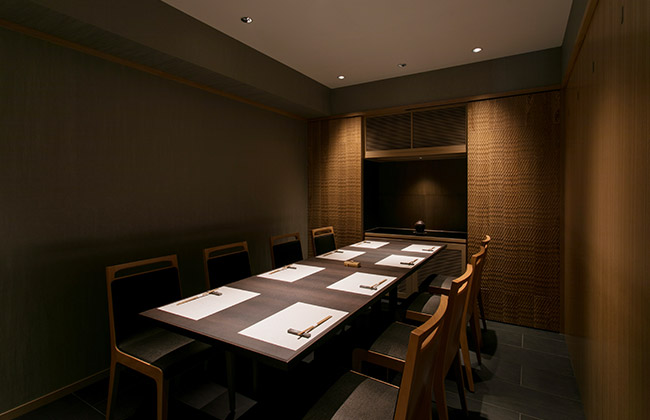
Locate an element on the screen. The image size is (650, 420). grey floor tiles is located at coordinates (519, 385).